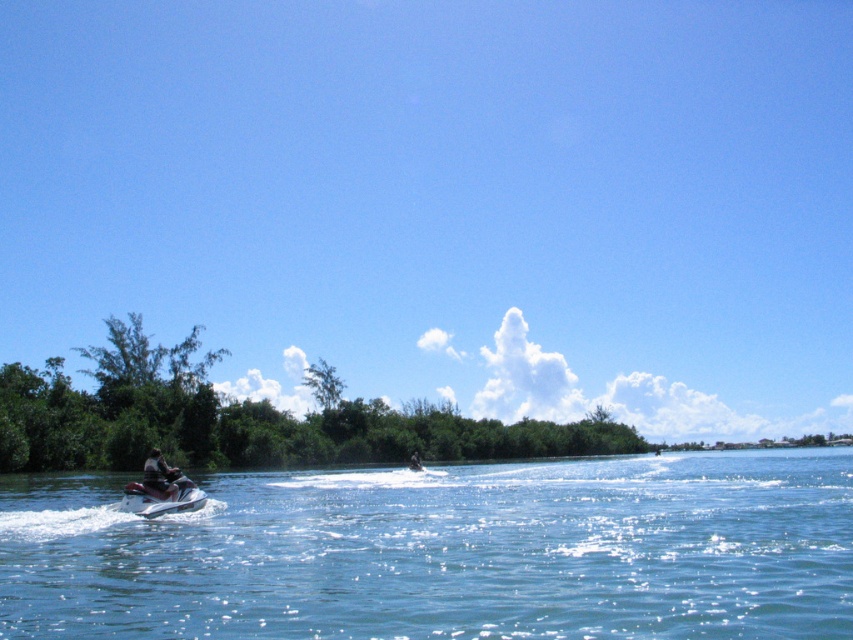
You are standing on a boat in the middle of the water and looking upward. Which object is positioned above the other between the blue sky at upper center and the dark brown leather jacket at center?

The blue sky at upper center is above the dark brown leather jacket at center.

You are a drone operator trying to capture aerial footage of the green leafy trees at center. Based on their position in the scene, where would you direct the drone to focus?

The green leafy trees at center are located at coordinates point (244,419), so you should direct the drone to focus there to capture their position accurately.